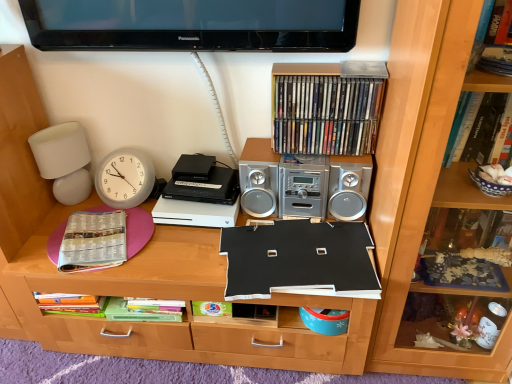
In order to face black matte paper at center, the second paperback book from the left, should I rotate leftwards or rightwards?

A 5.339 degree turn to the right will do.

The image size is (512, 384). I want to click on hardcover books at upper center, so click(326, 114).

Describe the element at coordinates (303, 184) in the screenshot. I see `silver metallic stereo at upper center` at that location.

In order to click on wooden bookcase at right in this screenshot , I will do `click(420, 178)`.

This screenshot has width=512, height=384. What do you see at coordinates (420, 178) in the screenshot? I see `wooden bookcase at right` at bounding box center [420, 178].

This screenshot has width=512, height=384. I want to click on white matte table lamp at left, so click(x=64, y=160).

Describe the element at coordinates (93, 241) in the screenshot. I see `white paper at left, the 2th paperback book positioned from the right` at that location.

Describe the element at coordinates (202, 181) in the screenshot. I see `black plastic cassette at center` at that location.

In order to click on black matte paper at center, the second paperback book from the left in this screenshot , I will do `click(298, 260)`.

Can you tell me how much black plastic cassette at center and black matte paper at center, arranged as the 1th paperback book when viewed from the right, differ in facing direction?

The angle between the facing direction of black plastic cassette at center and the facing direction of black matte paper at center, arranged as the 1th paperback book when viewed from the right, is 10.3 degrees.

Considering the positions of point (226, 186) and point (292, 223), is point (226, 186) closer or farther from the camera than point (292, 223)?

Point (226, 186) is positioned farther from the camera compared to point (292, 223).

From a real-world perspective, is black plastic cassette at center over black matte paper at center, the second paperback book from the left?

Yes, from a real-world perspective, black plastic cassette at center is above black matte paper at center, the second paperback book from the left.

Considering the sizes of objects black plastic cassette at center and black matte paper at center, the second paperback book from the left, in the image provided, who is wider, black plastic cassette at center or black matte paper at center, the second paperback book from the left,?

With larger width is black matte paper at center, the second paperback book from the left.

Is white matte table lamp at left at the left side of wooden bookcase at right?

Yes, white matte table lamp at left is to the left of wooden bookcase at right.

Is white matte table lamp at left far away from wooden bookcase at right?

Yes, white matte table lamp at left and wooden bookcase at right are quite far apart.

From a real-world perspective, is white matte table lamp at left positioned above or below wooden bookcase at right?

From a real-world perspective, white matte table lamp at left is physically below wooden bookcase at right.

Considering the sizes of white matte table lamp at left and wooden bookcase at right in the image, is white matte table lamp at left wider or thinner than wooden bookcase at right?

white matte table lamp at left is thinner than wooden bookcase at right.

Looking at this image, from a real-world perspective, is hardcover books at upper center positioned above or below silver metallic stereo at upper center?

hardcover books at upper center is above silver metallic stereo at upper center.

Between hardcover books at upper center and silver metallic stereo at upper center, which one has more height?

silver metallic stereo at upper center is taller.

From the picture: Considering the relative positions of hardcover books at upper center and silver metallic stereo at upper center in the image provided, is hardcover books at upper center in front of silver metallic stereo at upper center?

That is False.

From the image's perspective, is hardcover books at upper center located beneath silver metallic stereo at upper center?

Actually, hardcover books at upper center appears above silver metallic stereo at upper center in the image.

Which object is wider, white paper at left, acting as the 1th paperback book starting from the left, or silver metallic stereo at upper center?

white paper at left, acting as the 1th paperback book starting from the left.

In the image, there is a white paper at left, the 2th paperback book positioned from the right. Find the location of `stereo above it (from the image's perspective)`. stereo above it (from the image's perspective) is located at coordinates (303, 184).

Is white paper at left, the 2th paperback book positioned from the right, bigger than silver metallic stereo at upper center?

No, white paper at left, the 2th paperback book positioned from the right, is not bigger than silver metallic stereo at upper center.

Looking at their sizes, would you say wooden bookcase at right is wider or thinner than white paper at left, the 2th paperback book positioned from the right?

Considering their sizes, wooden bookcase at right looks broader than white paper at left, the 2th paperback book positioned from the right.

Based on the photo, between wooden bookcase at right and white paper at left, acting as the 1th paperback book starting from the left, which one has less height?

With less height is white paper at left, acting as the 1th paperback book starting from the left.

Based on the photo, could you tell me if wooden bookcase at right is facing white paper at left, the 2th paperback book positioned from the right?

No, wooden bookcase at right is not turned towards white paper at left, the 2th paperback book positioned from the right.

Can you confirm if wooden bookcase at right is positioned to the right of white paper at left, acting as the 1th paperback book starting from the left?

Yes.

Is black matte board at center with wooden bookcase at right?

There is a gap between black matte board at center and wooden bookcase at right.

Which of these two, black matte board at center or wooden bookcase at right, stands taller?

With more height is wooden bookcase at right.

What's the angular difference between black matte board at center and wooden bookcase at right's facing directions?

The angle between the facing direction of black matte board at center and the facing direction of wooden bookcase at right is 0.458 degrees.

Considering the sizes of objects hardcover books at upper center and white paper at left, the 2th paperback book positioned from the right, in the image provided, who is shorter, hardcover books at upper center or white paper at left, the 2th paperback book positioned from the right,?

Standing shorter between the two is white paper at left, the 2th paperback book positioned from the right.

How many degrees apart are the facing directions of hardcover books at upper center and white paper at left, the 2th paperback book positioned from the right?

There is a 18.7-degree angle between the facing directions of hardcover books at upper center and white paper at left, the 2th paperback book positioned from the right.

From the picture: Does hardcover books at upper center have a larger size compared to white paper at left, acting as the 1th paperback book starting from the left?

Yes, hardcover books at upper center is bigger than white paper at left, acting as the 1th paperback book starting from the left.

Measure the distance between hardcover books at upper center and white paper at left, the 2th paperback book positioned from the right.

hardcover books at upper center is 76.80 centimeters from white paper at left, the 2th paperback book positioned from the right.

Image resolution: width=512 pixels, height=384 pixels. In order to click on the 1st paperback book directly beneath the black plastic cassette at center (from a real-world perspective) in this screenshot , I will do coord(298,260).

Find the location of `bookcase in front of the white matte table lamp at left`. bookcase in front of the white matte table lamp at left is located at coordinates (420, 178).

Which object lies nearer to the anchor point white paper at left, the 2th paperback book positioned from the right, black matte paper at center, the second paperback book from the left, or wooden bookcase at right?

black matte paper at center, the second paperback book from the left, is closer to white paper at left, the 2th paperback book positioned from the right.

Which object lies nearer to the anchor point black matte board at center, black matte paper at center, the second paperback book from the left, or wooden bookcase at right?

black matte paper at center, the second paperback book from the left, lies closer to black matte board at center than the other object.

From the image, which object appears to be farther from wooden bookcase at right, black matte board at center or white paper at left, the 2th paperback book positioned from the right?

Among the two, white paper at left, the 2th paperback book positioned from the right, is located further to wooden bookcase at right.

Considering their positions, is black matte paper at center, the second paperback book from the left, positioned further to white paper at left, acting as the 1th paperback book starting from the left, than hardcover books at upper center?

Among the two, hardcover books at upper center is located further to white paper at left, acting as the 1th paperback book starting from the left.

Consider the image. Based on their spatial positions, is black matte paper at center, the second paperback book from the left, or black matte board at center further from hardcover books at upper center?

Based on the image, black matte board at center appears to be further to hardcover books at upper center.

From the image, which object appears to be farther from black plastic cassette at center, silver metallic stereo at upper center or hardcover books at upper center?

Among the two, hardcover books at upper center is located further to black plastic cassette at center.

Considering their positions, is black matte paper at center, arranged as the 1th paperback book when viewed from the right, positioned further to silver metallic stereo at upper center than wooden bookcase at right?

wooden bookcase at right is further to silver metallic stereo at upper center.

When comparing their distances from white matte table lamp at left, does white paper at left, acting as the 1th paperback book starting from the left, or silver metallic stereo at upper center seem closer?

Among the two, white paper at left, acting as the 1th paperback book starting from the left, is located nearer to white matte table lamp at left.

Where is `stereo situated between white matte table lamp at left and hardcover books at upper center from left to right`? This screenshot has width=512, height=384. stereo situated between white matte table lamp at left and hardcover books at upper center from left to right is located at coordinates (x=303, y=184).

Locate an element on the screen. desk situated between white matte table lamp at left and black matte paper at center, the second paperback book from the left, from left to right is located at coordinates (165, 298).

This screenshot has height=384, width=512. Find the location of `paperback book situated between white paper at left, the 2th paperback book positioned from the right, and hardcover books at upper center from left to right`. paperback book situated between white paper at left, the 2th paperback book positioned from the right, and hardcover books at upper center from left to right is located at coordinates (298, 260).

You are a GUI agent. You are given a task and a screenshot of the screen. Output one action in this format:
    pyautogui.click(x=<x>, y=<y>)
    Task: Click on the cassette between white paper at left, acting as the 1th paperback book starting from the left, and hardcover books at upper center, in the horizontal direction
    This screenshot has height=384, width=512.
    Given the screenshot: What is the action you would take?
    pyautogui.click(x=202, y=181)